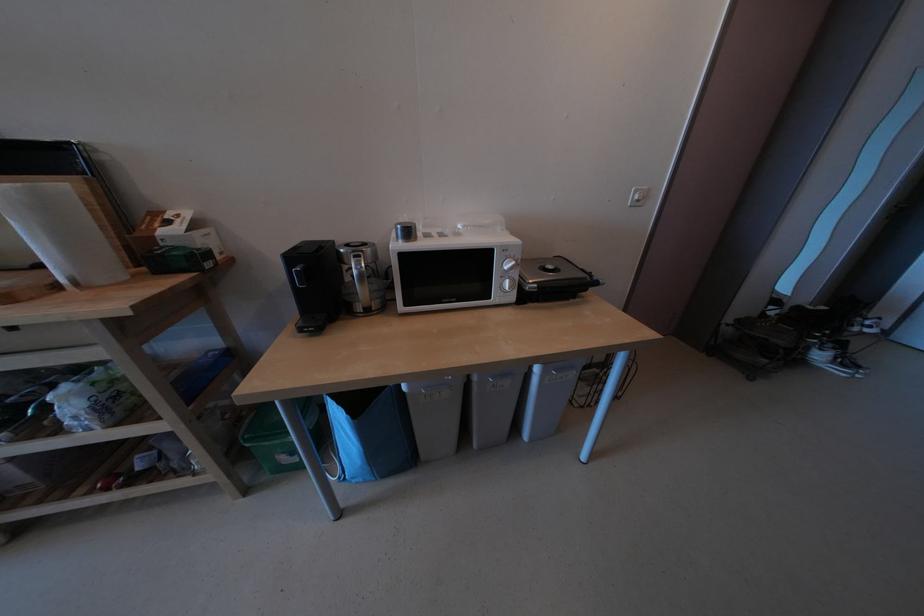
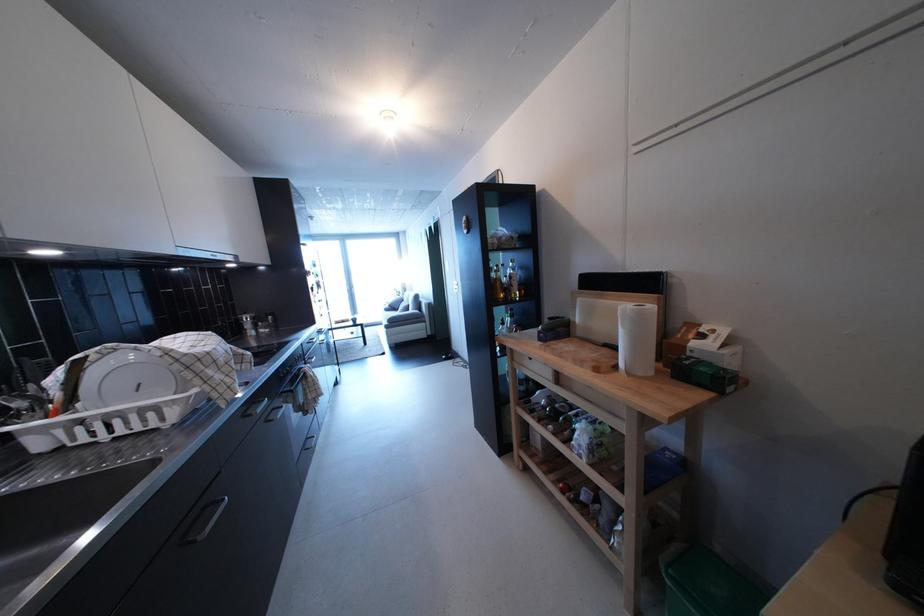
Where in the second image is the point corresponding to pixel 70 293 from the first image?

(628, 373)